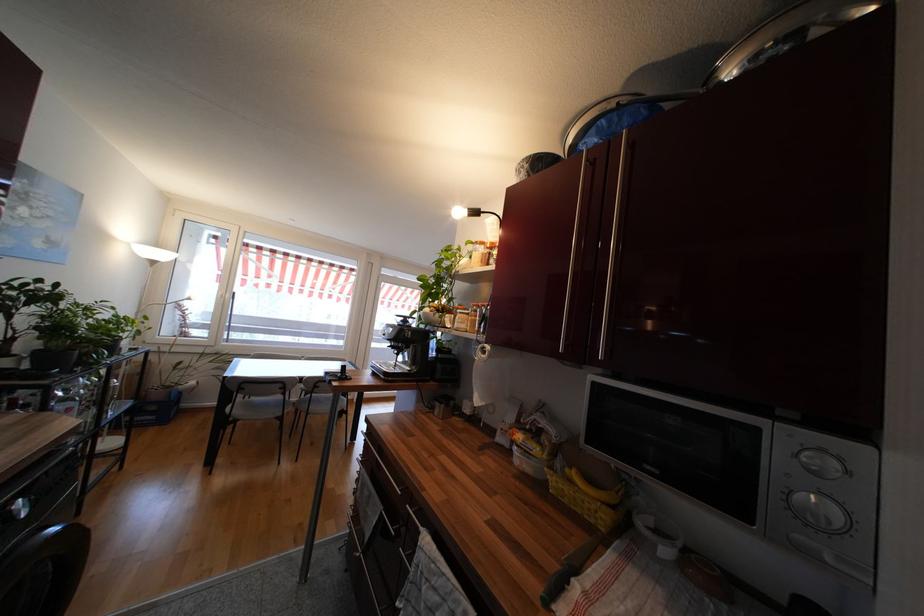
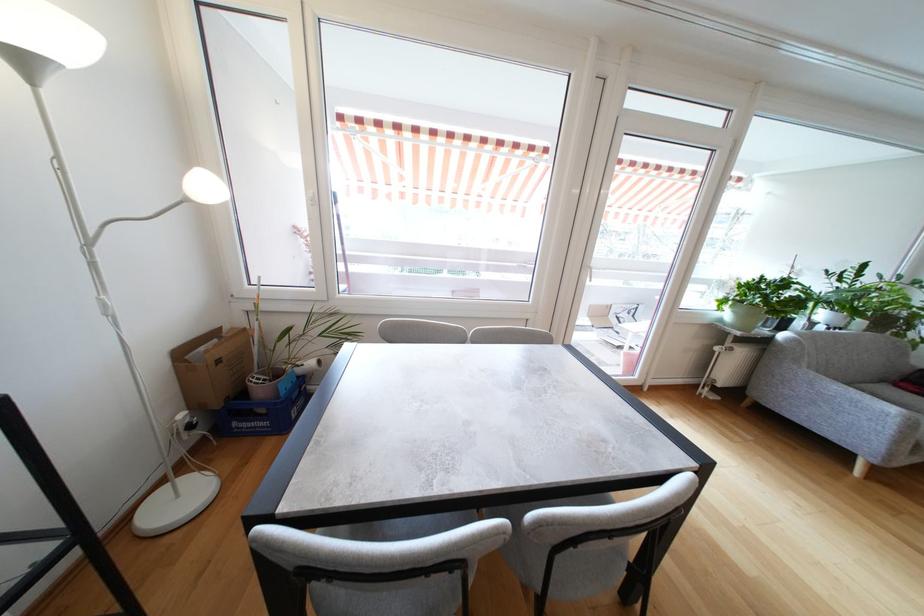
Locate, in the second image, the point that corresponds to pixel 225 299 in the first image.

(315, 201)